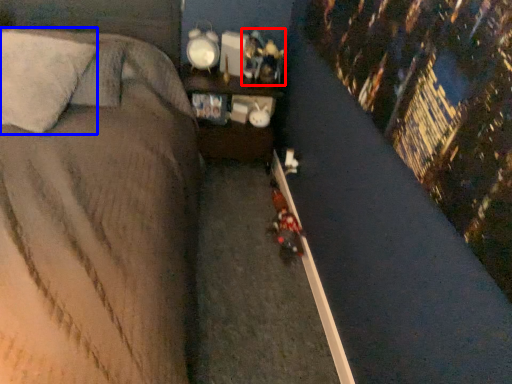
Question: Among these objects, which one is nearest to the camera, toy (highlighted by a red box) or pillow (highlighted by a blue box)?

Choices:
 (A) toy
 (B) pillow

Answer: (B)